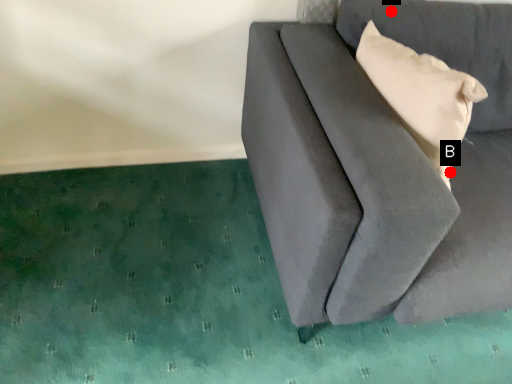
Question: Two points are circled on the image, labeled by A and B beside each circle. Which point is closer to the camera?

Choices:
 (A) A is closer
 (B) B is closer

Answer: (B)